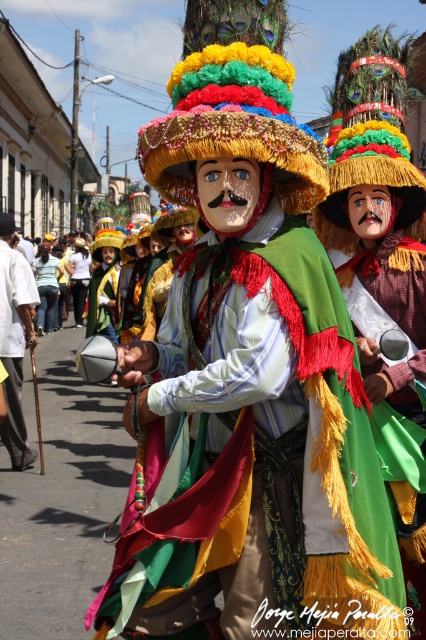
Which is behind, point (261, 276) or point (14, 268)?

The point (14, 268) is behind.

Is multicolored fabric costume at center above white cotton shirt at left?

No.

Find the location of a particular element. Image resolution: width=426 pixels, height=640 pixels. multicolored fabric costume at center is located at coordinates (256, 456).

This screenshot has height=640, width=426. Find the location of `multicolored fabric costume at center`. multicolored fabric costume at center is located at coordinates (256, 456).